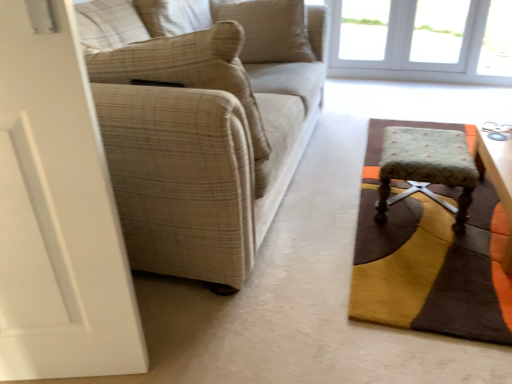
The width and height of the screenshot is (512, 384). What are the coordinates of `textured brown rug at lower right` in the screenshot? It's located at (430, 258).

Locate an element on the screen. This screenshot has width=512, height=384. floral fabric stool at lower right is located at coordinates (426, 167).

From their relative heights in the image, would you say beige textured pillow at upper center, which appears as the second pillow when viewed from the front, is taller or shorter than beige textured pillow at left, which is the 1th pillow from bottom to top?

beige textured pillow at upper center, which appears as the second pillow when viewed from the front, is shorter than beige textured pillow at left, which is the 1th pillow from bottom to top.

Does beige textured pillow at upper center, positioned as the 2th pillow in bottom-to-top order, have a lesser width compared to beige textured pillow at left, which appears as the 2th pillow when viewed from the back?

Yes, beige textured pillow at upper center, positioned as the 2th pillow in bottom-to-top order, is thinner than beige textured pillow at left, which appears as the 2th pillow when viewed from the back.

Is beige textured pillow at upper center, which appears as the first pillow when viewed from the back, not near beige textured pillow at left, which appears as the 2th pillow when viewed from the back?

Yes, beige textured pillow at upper center, which appears as the first pillow when viewed from the back, and beige textured pillow at left, which appears as the 2th pillow when viewed from the back, are quite far apart.

Looking at this image, could you measure the distance between beige textured pillow at upper center, which is the first pillow from top to bottom, and beige textured pillow at left, which appears as the 2th pillow when viewed from the back?

They are 4.08 feet apart.

Does beige textured pillow at left, which is the 1th pillow from bottom to top, have a lesser height compared to white glass window at upper right?

Yes, beige textured pillow at left, which is the 1th pillow from bottom to top, is shorter than white glass window at upper right.

Does beige textured pillow at left, which is the 2th pillow in top-to-bottom order, turn towards white glass window at upper right?

Yes.

You are a GUI agent. You are given a task and a screenshot of the screen. Output one action in this format:
    pyautogui.click(x=<x>, y=<y>)
    Task: Click on the window located above the beige textured pillow at left, which is the 2th pillow in top-to-bottom order (from the image's perspective)
    The width and height of the screenshot is (512, 384).
    Given the screenshot: What is the action you would take?
    pyautogui.click(x=422, y=40)

Could you tell me if white glass window at upper right is facing beige textured pillow at left, which is the 2th pillow in top-to-bottom order?

Yes.

Considering the sizes of objects white glass window at upper right and beige textured pillow at left, which appears as the 2th pillow when viewed from the back, in the image provided, who is bigger, white glass window at upper right or beige textured pillow at left, which appears as the 2th pillow when viewed from the back,?

With larger size is beige textured pillow at left, which appears as the 2th pillow when viewed from the back.

Which is correct: white glass window at upper right is inside beige textured pillow at left, which appears as the 2th pillow when viewed from the back, or outside of it?

The correct answer is: outside.

Which object is positioned more to the left, white glass window at upper right or beige textured pillow at left, which appears as the 2th pillow when viewed from the back?

beige textured pillow at left, which appears as the 2th pillow when viewed from the back.

Is wooden round table at right far from floral fabric stool at lower right?

No, wooden round table at right is not far from floral fabric stool at lower right.

Is wooden round table at right situated inside floral fabric stool at lower right or outside?

wooden round table at right is not inside floral fabric stool at lower right, it's outside.

Which of these two, wooden round table at right or floral fabric stool at lower right, stands taller?

Standing taller between the two is floral fabric stool at lower right.

Considering the positions of objects wooden round table at right and floral fabric stool at lower right in the image provided, who is behind, wooden round table at right or floral fabric stool at lower right?

floral fabric stool at lower right is more distant.

The image size is (512, 384). I want to click on round table above the textured brown rug at lower right (from a real-world perspective), so click(x=496, y=160).

Is the surface of wooden round table at right in direct contact with textured brown rug at lower right?

wooden round table at right is not next to textured brown rug at lower right, and they're not touching.

Which object is wider, wooden round table at right or textured brown rug at lower right?

textured brown rug at lower right.

Who is taller, wooden round table at right or textured brown rug at lower right?

Standing taller between the two is wooden round table at right.

From the image's perspective, which object appears higher, textured brown rug at lower right or white glass window at upper right?

white glass window at upper right appears higher in the image.

Can you confirm if textured brown rug at lower right is taller than white glass window at upper right?

No.

Which is more to the right, textured brown rug at lower right or white glass window at upper right?

From the viewer's perspective, white glass window at upper right appears more on the right side.

Which is further, (440, 210) or (490, 17)?

The point (490, 17) is behind.

How different are the orientations of white glass window at upper right and beige plaid fabric couch at left in degrees?

89.1 degrees.

Between white glass window at upper right and beige plaid fabric couch at left, which one has smaller width?

Thinner between the two is white glass window at upper right.

Which object is more forward, white glass window at upper right or beige plaid fabric couch at left?

Positioned in front is beige plaid fabric couch at left.

In the scene shown: Is there a large distance between white glass window at upper right and beige plaid fabric couch at left?

white glass window at upper right is far away from beige plaid fabric couch at left.

This screenshot has width=512, height=384. What are the coordinates of `pillow that is behind the beige textured pillow at left, which appears as the 2th pillow when viewed from the back` in the screenshot? It's located at (269, 29).

Locate an element on the screen. The image size is (512, 384). the 2nd pillow positioned below the white glass window at upper right (from the image's perspective) is located at coordinates (187, 68).

Estimate the real-world distances between objects in this image. Which object is further from beige textured pillow at upper center, which is the first pillow from top to bottom, textured brown rug at lower right or beige plaid fabric couch at left?

textured brown rug at lower right is positioned further to the anchor beige textured pillow at upper center, which is the first pillow from top to bottom.

Estimate the real-world distances between objects in this image. Which object is closer to textured brown rug at lower right, white glass window at upper right or floral fabric stool at lower right?

Among the two, floral fabric stool at lower right is located nearer to textured brown rug at lower right.

Which object lies nearer to the anchor point floral fabric stool at lower right, textured brown rug at lower right or white glass window at upper right?

textured brown rug at lower right.

Based on their spatial positions, is textured brown rug at lower right or beige textured pillow at left, the first pillow from the front, closer to beige plaid fabric couch at left?

beige textured pillow at left, the first pillow from the front.

Looking at the image, which one is located closer to floral fabric stool at lower right, beige plaid fabric couch at left or wooden round table at right?

Based on the image, wooden round table at right appears to be nearer to floral fabric stool at lower right.

Considering their positions, is white glass window at upper right positioned further to wooden round table at right than beige plaid fabric couch at left?

The object further to wooden round table at right is white glass window at upper right.

When comparing their distances from textured brown rug at lower right, does white glass window at upper right or beige plaid fabric couch at left seem closer?

Based on the image, beige plaid fabric couch at left appears to be nearer to textured brown rug at lower right.

Based on their spatial positions, is beige plaid fabric couch at left or wooden round table at right further from white glass window at upper right?

beige plaid fabric couch at left is positioned further to the anchor white glass window at upper right.

Locate an element on the screen. pillow situated between beige textured pillow at left, which is the 2th pillow in top-to-bottom order, and wooden round table at right from left to right is located at coordinates (269, 29).

Image resolution: width=512 pixels, height=384 pixels. Find the location of `table positioned between beige plaid fabric couch at left and white glass window at upper right from near to far`. table positioned between beige plaid fabric couch at left and white glass window at upper right from near to far is located at coordinates (426, 167).

Locate an element on the screen. This screenshot has width=512, height=384. table positioned between textured brown rug at lower right and beige textured pillow at upper center, which appears as the first pillow when viewed from the back, from near to far is located at coordinates (426, 167).

Where is `round table between beige plaid fabric couch at left and white glass window at upper right in the front-back direction`? Image resolution: width=512 pixels, height=384 pixels. round table between beige plaid fabric couch at left and white glass window at upper right in the front-back direction is located at coordinates (496, 160).